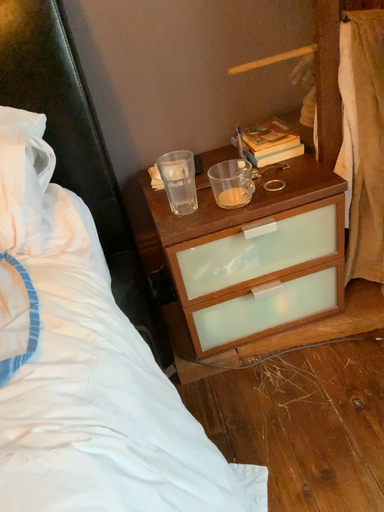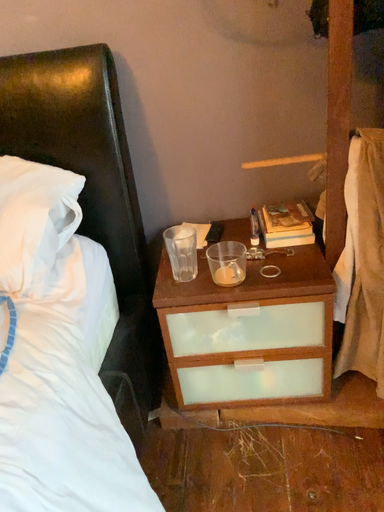
Question: How did the camera likely rotate when shooting the video?

Choices:
 (A) rotated right
 (B) rotated left

Answer: (B)